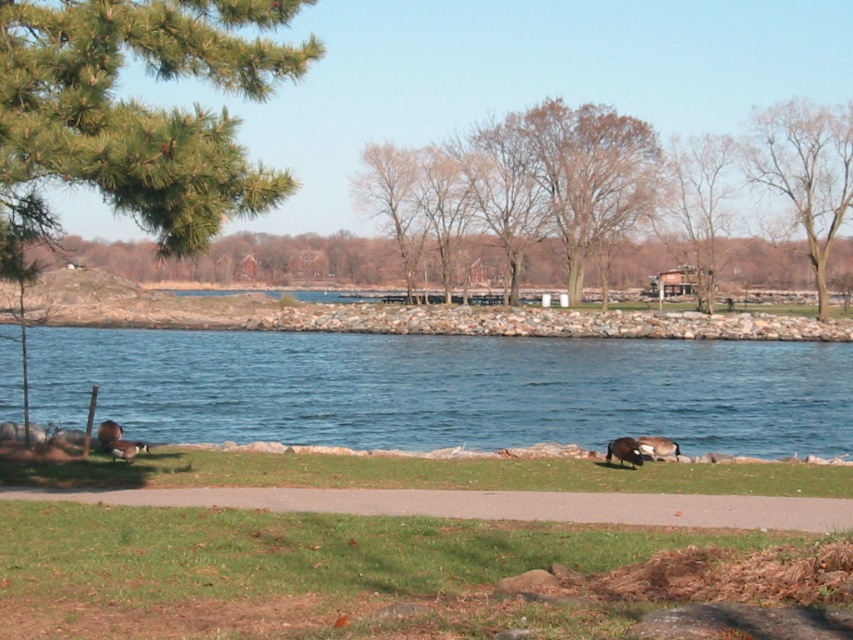
Question: Does green grass at lower center have a larger size compared to brown fuzzy duck at lower center?

Choices:
 (A) yes
 (B) no

Answer: (B)

Question: Does green needle-like leaves at left have a larger size compared to brown wood tree at upper center?

Choices:
 (A) yes
 (B) no

Answer: (B)

Question: Which object appears closest to the camera in this image?

Choices:
 (A) green grass at lower center
 (B) brown wood tree at upper center

Answer: (A)

Question: Among these objects, which one is nearest to the camera?

Choices:
 (A) green grass at lower center
 (B) blue water at lower left
 (C) green needle-like leaves at left

Answer: (A)

Question: Observing the image, what is the correct spatial positioning of blue water at lower left in reference to bare wood tree at upper right?

Choices:
 (A) right
 (B) left

Answer: (B)

Question: Which object is farther from the camera taking this photo?

Choices:
 (A) bare wood tree at upper right
 (B) blue water at lower left
 (C) green grass at lower center

Answer: (A)